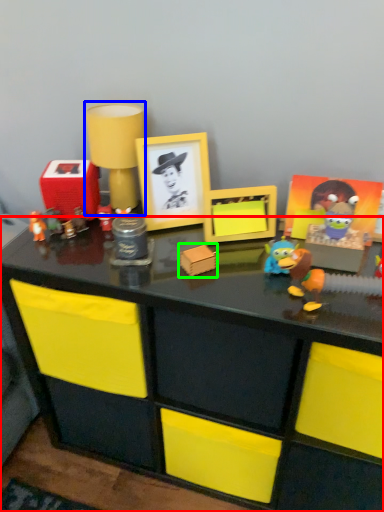
Question: Considering the real-world distances, which object is closest to desk (highlighted by a red box)? toy (highlighted by a blue box) or toy (highlighted by a green box).

Choices:
 (A) toy
 (B) toy

Answer: (B)